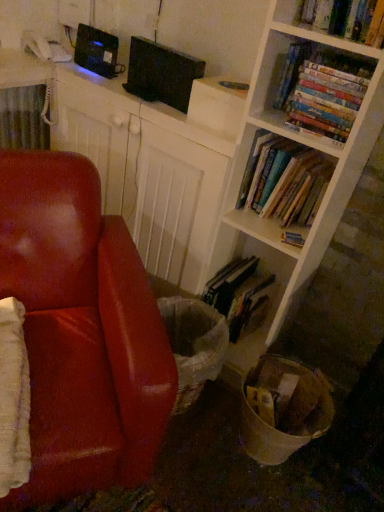
Question: Is hardcover books at upper right, acting as the fourth book starting from the bottom, taller or shorter than black matte computer at upper center?

Choices:
 (A) short
 (B) tall

Answer: (A)

Question: Is point (365, 74) closer or farther from the camera than point (208, 218)?

Choices:
 (A) farther
 (B) closer

Answer: (B)

Question: Which object is positioned farthest from the hardcover books at upper right, acting as the fourth book starting from the bottom?

Choices:
 (A) hardcover book at lower center, which is the 4th book from top to bottom
 (B) leather at left
 (C) black matte computer at upper center
 (D) hardcover books at center right, arranged as the 2th book when viewed from the top
 (E) hardcover book at center, the second book in the bottom-to-top sequence

Answer: (B)

Question: Estimate the real-world distances between objects in this image. Which object is closer to the hardcover book at center, the second book in the bottom-to-top sequence?

Choices:
 (A) hardcover book at lower center, which is the 4th book from top to bottom
 (B) leather at left
 (C) hardcover books at upper right, which appears as the 1th book when viewed from the top
 (D) hardcover books at center right, arranged as the 2th book when viewed from the top
 (E) black matte computer at upper center

Answer: (D)